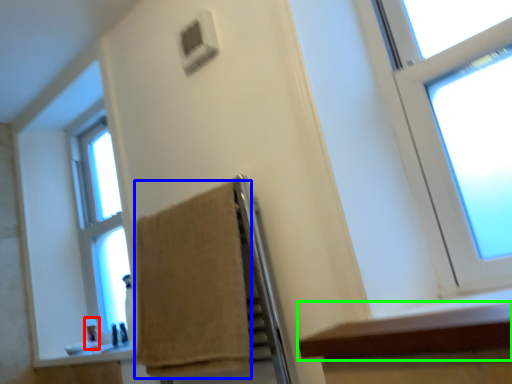
Question: Estimate the real-world distances between objects in this image. Which object is farther from toiletry (highlighted by a red box), towel (highlighted by a blue box) or ledge (highlighted by a green box)?

Choices:
 (A) towel
 (B) ledge

Answer: (B)